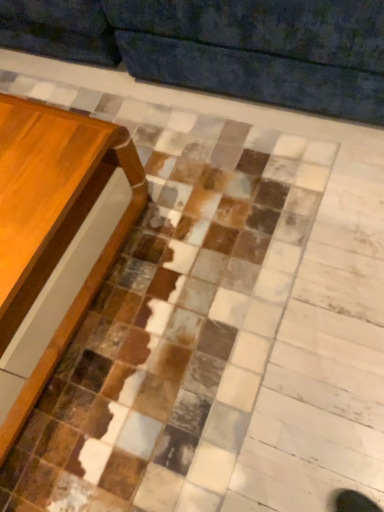
Where is `wooden table at left`? The image size is (384, 512). wooden table at left is located at coordinates (54, 219).

What do you see at coordinates (54, 219) in the screenshot? I see `wooden table at left` at bounding box center [54, 219].

I want to click on wooden table at left, so click(x=54, y=219).